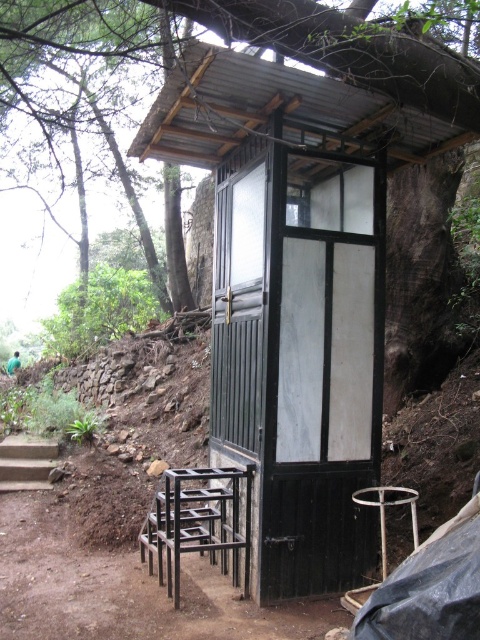
Question: Estimate the real-world distances between objects in this image. Which object is farther from the black wood/paneling toilet at center?

Choices:
 (A) black metal stool at lower left
 (B) concrete stairs at lower left

Answer: (B)

Question: Is black metal stool at lower left to the right of concrete stairs at lower left from the viewer's perspective?

Choices:
 (A) yes
 (B) no

Answer: (A)

Question: Which object is farther from the camera taking this photo?

Choices:
 (A) black wood/paneling toilet at center
 (B) concrete stairs at lower left
 (C) metallic black stool at center
 (D) black metal stool at lower left

Answer: (B)

Question: Is black wood/paneling toilet at center to the left of black metal stool at lower left from the viewer's perspective?

Choices:
 (A) no
 (B) yes

Answer: (A)

Question: Which object appears farthest from the camera in this image?

Choices:
 (A) metallic black stool at center
 (B) concrete stairs at lower left

Answer: (B)

Question: Is black wood/paneling toilet at center below metallic black stool at center?

Choices:
 (A) yes
 (B) no

Answer: (B)